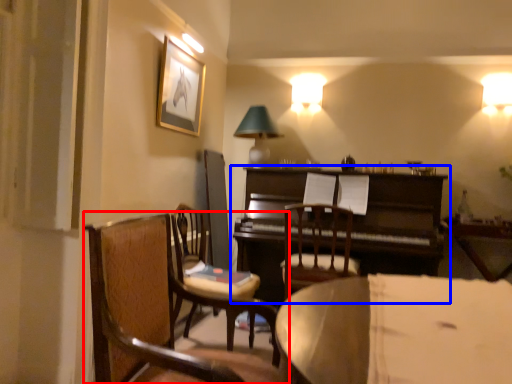
Question: Among these objects, which one is farthest to the camera, chair (highlighted by a red box) or piano (highlighted by a blue box)?

Choices:
 (A) chair
 (B) piano

Answer: (B)